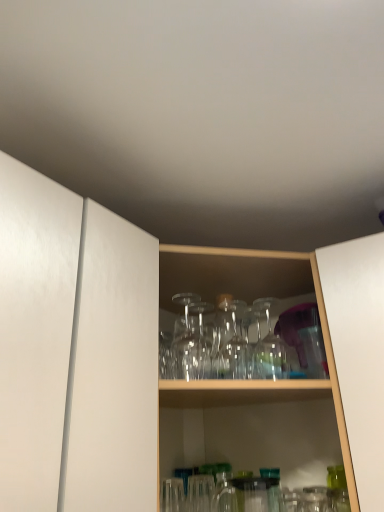
Describe the element at coordinates (284, 381) in the screenshot. I see `transparent glassware at center` at that location.

Find the location of a particular element. This screenshot has height=512, width=384. transparent glassware at center is located at coordinates (284, 381).

Measure the distance between point (170, 386) and camera.

Point (170, 386) is 96.30 centimeters away from camera.

Where is `transparent glassware at center`? This screenshot has width=384, height=512. transparent glassware at center is located at coordinates (284, 381).